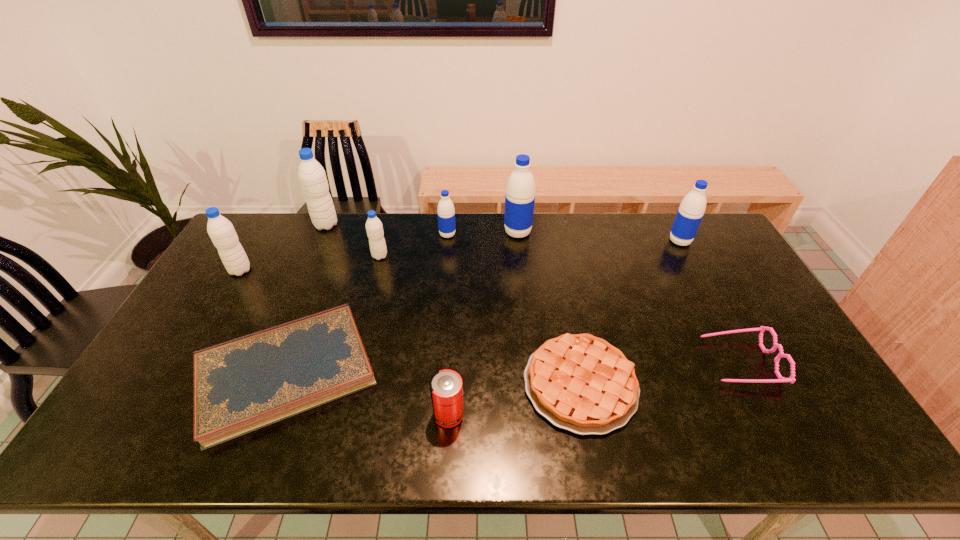
Locate an element on the screen. free location located 0.140m on the left of the rightmost water bottle is located at coordinates (629, 241).

Identify the location of free region located 0.250m on the front of the leftmost blue water bottle. The width and height of the screenshot is (960, 540). (443, 289).

Find the location of a particular element. The height and width of the screenshot is (540, 960). vacant space situated on the front of the fifth farthest object is located at coordinates (375, 273).

At what (x,y) coordinates should I click in order to perform the action: click on free space located 0.240m on the back of the fourth shortest object. Please return your answer as a coordinate pair (x, y). Looking at the image, I should click on (454, 328).

Where is `free space located on the arms of the eighth tallest object`? free space located on the arms of the eighth tallest object is located at coordinates (578, 362).

I want to click on blank area located on the arms of the eighth tallest object, so click(563, 362).

The height and width of the screenshot is (540, 960). What are the coordinates of `vacant space situated on the arms of the eighth tallest object` in the screenshot? It's located at (685, 362).

Image resolution: width=960 pixels, height=540 pixels. What are the coordinates of `vacant space located on the left of the second shortest object` in the screenshot? It's located at (372, 384).

Identify the location of vacant region located 0.090m on the back of the shortest object. The height and width of the screenshot is (540, 960). (317, 291).

The height and width of the screenshot is (540, 960). Find the location of `can that is at the near edge`. can that is at the near edge is located at coordinates (446, 388).